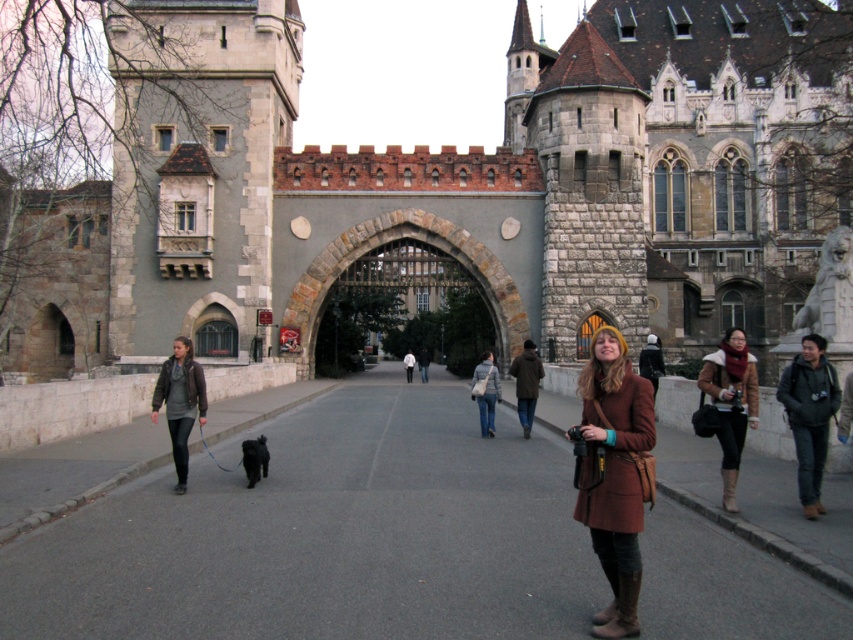
You are standing at the entrance of the historic stone structure and notice two people walking towards the gate. One is wearing blue jeans at center and the other is wearing a dark brown leather jacket at center. Which person is closer to you?

The blue jeans at center is closer to the viewer than the dark brown leather jacket at center, so the person wearing blue jeans at center is closer to you.

You are standing at the entrance of the historic stone structure and want to locate the brown leather jacket at center. According to the coordinates provided, where would you look in the image to find it?

The brown leather jacket at center is located at the 2D coordinates point (526,384) in the image.

Based on the photo, you are standing at the entrance of the historic stone structure and want to greet a friend wearing a dark brown leather jacket at center who is walking along the pathway. If you start walking from the blue jeans at center towards the gate, will you be moving towards or away from your friend?

The blue jeans at center and dark brown leather jacket at center are 15.70 meters apart. Since you are moving from the blue jeans at center towards the gate, you are moving away from the dark brown leather jacket at center.